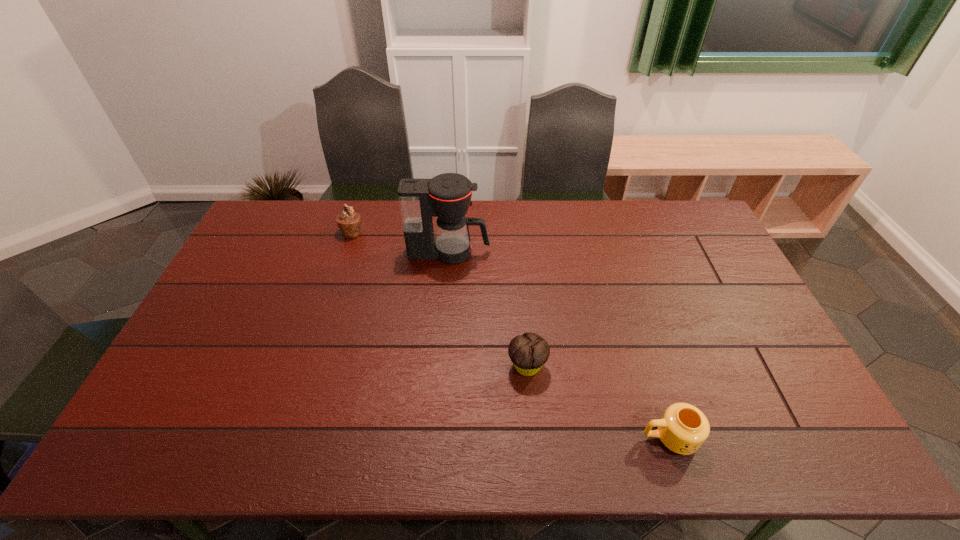
Identify the location of vacant space located on the back of the nearer muffin. Image resolution: width=960 pixels, height=540 pixels. (522, 316).

I want to click on vacant region located on the handle side of the nearest object, so click(494, 438).

You are a GUI agent. You are given a task and a screenshot of the screen. Output one action in this format:
    pyautogui.click(x=<x>, y=<y>)
    Task: Click on the vacant space located 0.080m on the handle side of the nearest object
    Image resolution: width=960 pixels, height=540 pixels.
    Given the screenshot: What is the action you would take?
    pyautogui.click(x=608, y=438)

Find the location of a particular element. The width and height of the screenshot is (960, 540). free space located 0.320m on the handle side of the nearest object is located at coordinates (508, 438).

Identify the location of coffee maker positioned at the far edge. (447, 196).

At what (x,y) coordinates should I click in order to perform the action: click on muffin that is positioned at the far edge. Please return your answer as a coordinate pair (x, y). The width and height of the screenshot is (960, 540). Looking at the image, I should click on (349, 222).

Find the location of a particular element. The width and height of the screenshot is (960, 540). object present at the near edge is located at coordinates pyautogui.click(x=683, y=428).

The height and width of the screenshot is (540, 960). In the image, there is a desktop. Find the location of `vacant space at the far edge`. vacant space at the far edge is located at coordinates (514, 219).

This screenshot has width=960, height=540. What are the coordinates of `free space at the near edge of the desktop` in the screenshot? It's located at (660, 445).

Where is `blank space at the left edge of the desktop`? The width and height of the screenshot is (960, 540). blank space at the left edge of the desktop is located at coordinates (162, 411).